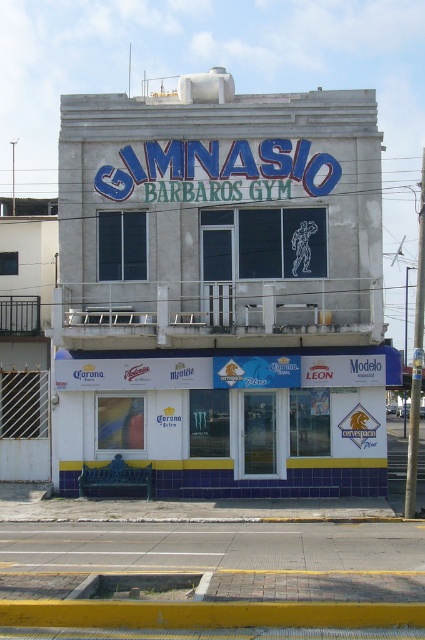
Does blue tile bench at lower center have a greater width compared to yellow concrete curb at lower center?

No.

Is point (357, 403) positioned in front of point (380, 614)?

No, it is behind (380, 614).

Find the location of a particular element. blue tile bench at lower center is located at coordinates (229, 419).

Can you confirm if white concrete building at center is smaller than blue tile bench at lower center?

Actually, white concrete building at center might be larger than blue tile bench at lower center.

Which is below, white concrete building at center or blue tile bench at lower center?

blue tile bench at lower center is below.

Which is in front, point (90, 420) or point (227, 468)?

Point (227, 468) is in front.

Locate an element on the screen. Image resolution: width=425 pixels, height=640 pixels. white concrete building at center is located at coordinates (221, 291).

Does white concrete building at center come in front of yellow concrete curb at lower center?

That is False.

Can you confirm if white concrete building at center is thinner than yellow concrete curb at lower center?

No, white concrete building at center is not thinner than yellow concrete curb at lower center.

Between point (311, 100) and point (195, 604), which one is positioned behind?

The point (311, 100) is behind.

Find the location of `white concrete building at center`. white concrete building at center is located at coordinates (221, 291).